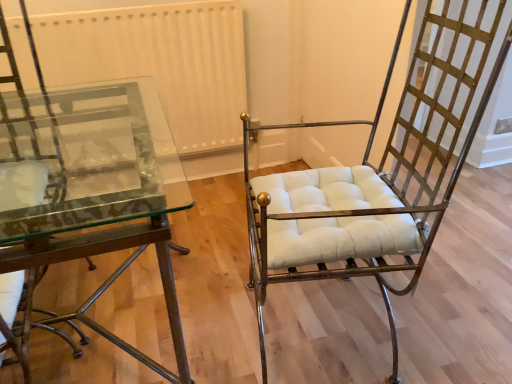
Question: Considering the positions of gold textured metal chair at right, placed as the 2th chair when sorted from left to right, and white textured radiator at upper center in the image, is gold textured metal chair at right, placed as the 2th chair when sorted from left to right, taller or shorter than white textured radiator at upper center?

Choices:
 (A) tall
 (B) short

Answer: (A)

Question: Considering the relative positions of gold textured metal chair at right, placed as the 2th chair when sorted from left to right, and white textured radiator at upper center in the image provided, is gold textured metal chair at right, placed as the 2th chair when sorted from left to right, to the left or to the right of white textured radiator at upper center?

Choices:
 (A) right
 (B) left

Answer: (A)

Question: Estimate the real-world distances between objects in this image. Which object is farther from the white textured radiator at upper center?

Choices:
 (A) clear glass table at left
 (B) metallic glass table at left, which appears as the second chair when viewed from the right
 (C) gold textured metal chair at right, placed as the 2th chair when sorted from left to right

Answer: (C)

Question: Considering the real-world distances, which object is farthest from the metallic glass table at left, which appears as the second chair when viewed from the right?

Choices:
 (A) white textured radiator at upper center
 (B) gold textured metal chair at right, placed as the 2th chair when sorted from left to right
 (C) clear glass table at left

Answer: (B)